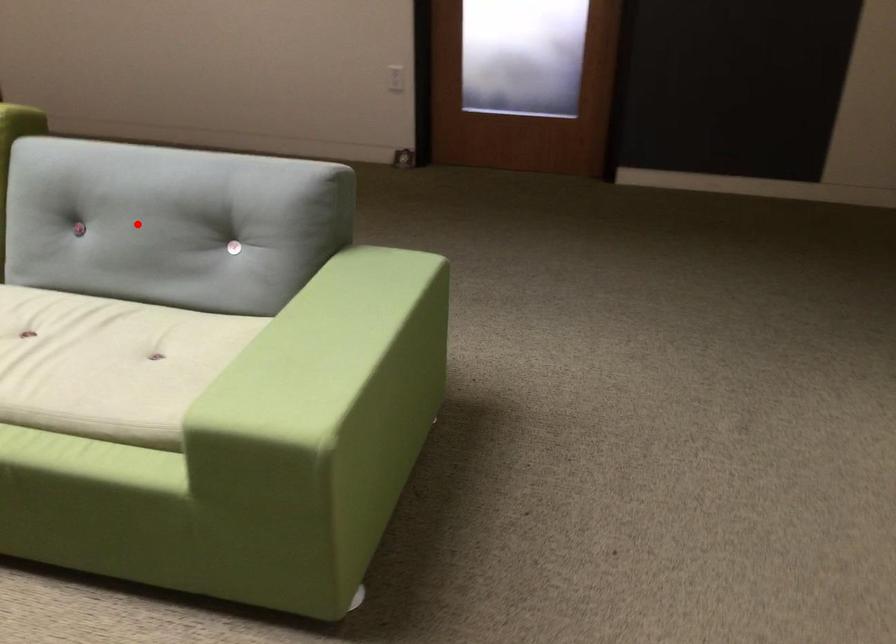
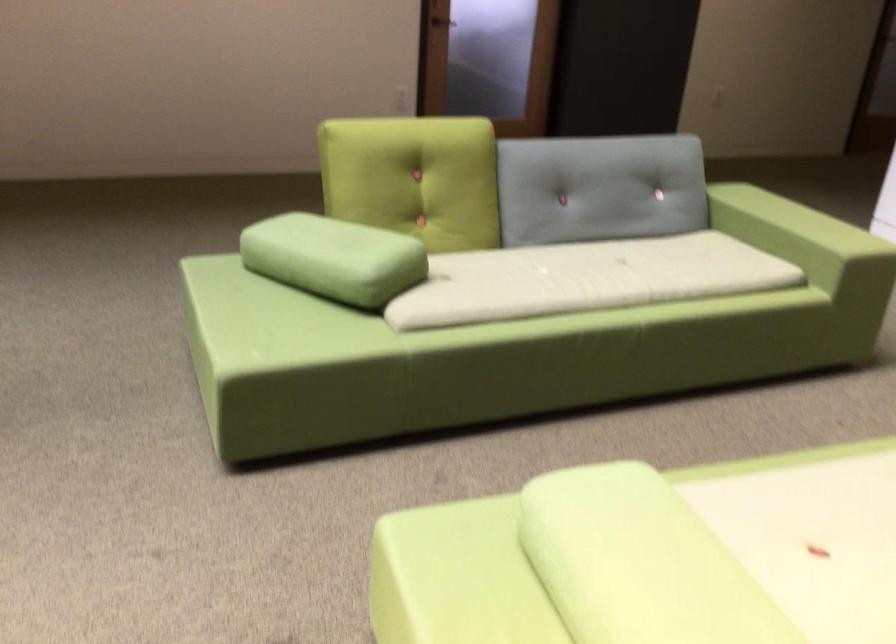
Where in the second image is the point corresponding to the highlighted location from the first image?

(599, 187)